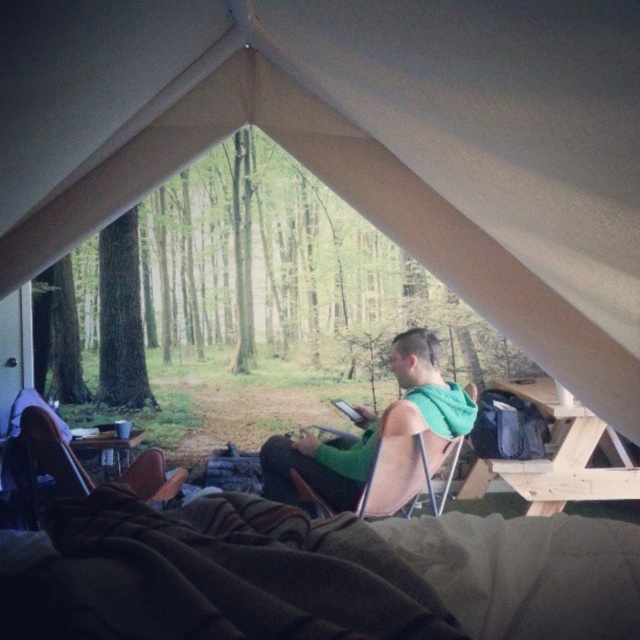
You are setting up a tent and need to place a brown leather chair at lower left and a wooden picnic table at center. Given their heights, which object should be placed closer to the entrance for easier access?

The wooden picnic table at center should be placed closer to the entrance since it is shorter than the brown leather chair at lower left, making it easier to access without obstruction.